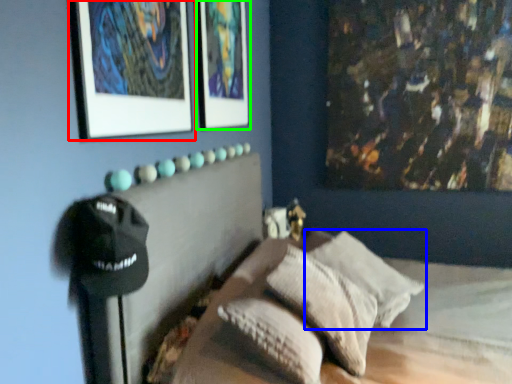
Question: Considering the real-world distances, which object is closest to picture frame (highlighted by a red box)? pillow (highlighted by a blue box) or picture frame (highlighted by a green box).

Choices:
 (A) pillow
 (B) picture frame

Answer: (B)